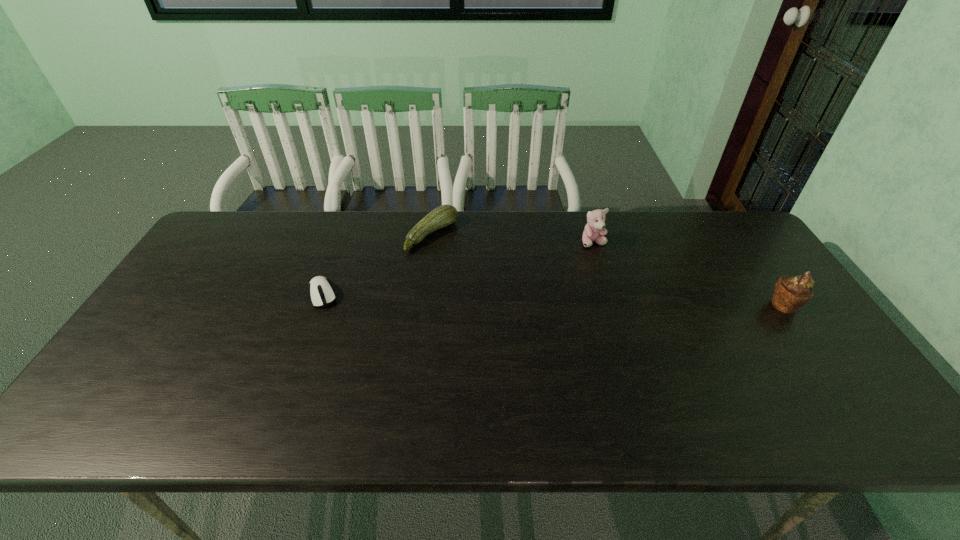
At what (x,y) coordinates should I click in order to perform the action: click on vacant space located at the face of the second object from right to left. Please return your answer as a coordinate pair (x, y). The image size is (960, 540). Looking at the image, I should click on (598, 264).

The image size is (960, 540). Identify the location of vacant region located 0.230m at the stem end of the second shortest object. (506, 281).

This screenshot has width=960, height=540. I want to click on free spot located 0.330m at the stem end of the second shortest object, so click(534, 298).

At what (x,y) coordinates should I click in order to perform the action: click on vacant space located 0.200m at the stem end of the second shortest object. Please return your answer as a coordinate pair (x, y). Image resolution: width=960 pixels, height=540 pixels. Looking at the image, I should click on (498, 276).

Where is `teddy bear that is at the far edge`? This screenshot has height=540, width=960. teddy bear that is at the far edge is located at coordinates (594, 230).

This screenshot has width=960, height=540. Find the location of `zucchini that is positioned at the far edge`. zucchini that is positioned at the far edge is located at coordinates (444, 215).

Locate an element on the screen. This screenshot has width=960, height=540. object that is at the right edge is located at coordinates (791, 293).

The width and height of the screenshot is (960, 540). In order to click on vacant space at the far edge of the desktop in this screenshot , I will do tap(645, 254).

Image resolution: width=960 pixels, height=540 pixels. In order to click on vacant area at the near edge in this screenshot , I will do `click(636, 388)`.

Locate an element on the screen. Image resolution: width=960 pixels, height=540 pixels. vacant space at the left edge of the desktop is located at coordinates (228, 276).